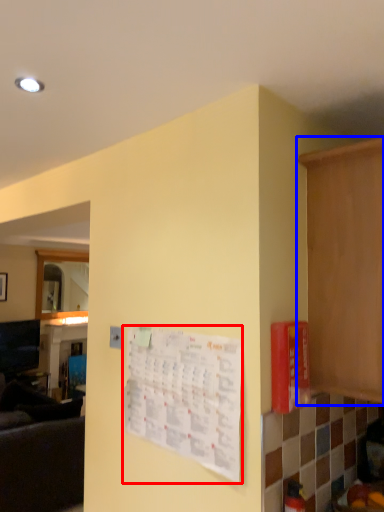
Question: Which of the following is the closest to the observer, bulletin board (highlighted by a red box) or cabinetry (highlighted by a blue box)?

Choices:
 (A) bulletin board
 (B) cabinetry

Answer: (B)